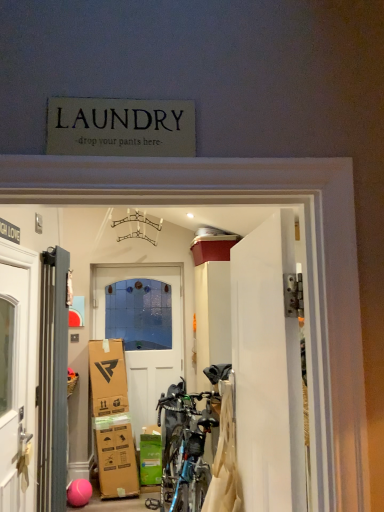
How much space does metallic gray radiator at left, placed as the 2th door when sorted from front to back, occupy horizontally?

It is 3.62 inches.

Where is `green cardboard box at lower center`? The width and height of the screenshot is (384, 512). green cardboard box at lower center is located at coordinates (150, 456).

Does metallic gray radiator at left, positioned as the 2th door in back-to-front order, turn towards green cardboard box at lower center?

No, metallic gray radiator at left, positioned as the 2th door in back-to-front order, is not oriented towards green cardboard box at lower center.

Is point (50, 398) closer to camera compared to point (146, 463)?

That is True.

Do you think metallic gray radiator at left, placed as the 2th door when sorted from front to back, is within green cardboard box at lower center, or outside of it?

The correct answer is: outside.

From a real-world perspective, is metallic gray radiator at left, the third door when ordered from right to left, under white glossy door at center, positioned as the first door in right-to-left order?

Correct, in the physical world, metallic gray radiator at left, the third door when ordered from right to left, is lower than white glossy door at center, positioned as the first door in right-to-left order.

Does metallic gray radiator at left, the 1th door positioned from the left, have a greater height compared to white glossy door at center, placed as the 3th door when sorted from left to right?

Indeed, metallic gray radiator at left, the 1th door positioned from the left, has a greater height compared to white glossy door at center, placed as the 3th door when sorted from left to right.

Which object is positioned more to the right, white wooden door at center, placed as the 2th door when sorted from left to right, or white glossy door at center, which ranks as the first door in front-to-back order?

Positioned to the right is white glossy door at center, which ranks as the first door in front-to-back order.

Is white glossy door at center, the third door from the back, a part of white wooden door at center, acting as the 2th door starting from the right?

Actually, white glossy door at center, the third door from the back, is outside white wooden door at center, acting as the 2th door starting from the right.

I want to click on the 1st door above when counting from the green cardboard box at lower center (from the image's perspective), so click(x=143, y=331).

From the image's perspective, is white wooden door at center, which ranks as the 1th door in back-to-front order, on green cardboard box at lower center?

Yes.

Can you confirm if white wooden door at center, which is the third door from front to back, is shorter than green cardboard box at lower center?

In fact, white wooden door at center, which is the third door from front to back, may be taller than green cardboard box at lower center.

Who is more distant, white wooden door at center, which is the third door from front to back, or green cardboard box at lower center?

white wooden door at center, which is the third door from front to back, is further from the camera.

Can you confirm if green cardboard box at lower center is positioned to the right of white glossy door at center, the third door from the back?

No.

Is green cardboard box at lower center bigger or smaller than white glossy door at center, which ranks as the first door in front-to-back order?

In the image, green cardboard box at lower center appears to be smaller than white glossy door at center, which ranks as the first door in front-to-back order.

Could you measure the distance between green cardboard box at lower center and white glossy door at center, placed as the 3th door when sorted from left to right?

green cardboard box at lower center and white glossy door at center, placed as the 3th door when sorted from left to right, are 9.46 feet apart from each other.

From a real-world perspective, who is located higher, white wooden door at center, acting as the 2th door starting from the right, or metallic gray radiator at left, the 1th door positioned from the left?

metallic gray radiator at left, the 1th door positioned from the left, is physically above.

Is white wooden door at center, which ranks as the 1th door in back-to-front order, smaller than metallic gray radiator at left, the third door when ordered from right to left?

Actually, white wooden door at center, which ranks as the 1th door in back-to-front order, might be larger than metallic gray radiator at left, the third door when ordered from right to left.

Identify the location of door that is the 1st one when counting rightward from the metallic gray radiator at left, the third door when ordered from right to left. Image resolution: width=384 pixels, height=512 pixels. (143, 331).

Are green cardboard box at lower center and white wooden door at center, placed as the 2th door when sorted from left to right, located far from each other?

green cardboard box at lower center is near white wooden door at center, placed as the 2th door when sorted from left to right, not far away.

From a real-world perspective, which is physically below, green cardboard box at lower center or white wooden door at center, which ranks as the 1th door in back-to-front order?

green cardboard box at lower center.

Is green cardboard box at lower center oriented away from white wooden door at center, acting as the 2th door starting from the right?

Yes, white wooden door at center, acting as the 2th door starting from the right, is at the back of green cardboard box at lower center.

Does green cardboard box at lower center have a smaller size compared to white wooden door at center, acting as the 2th door starting from the right?

Yes, green cardboard box at lower center is smaller than white wooden door at center, acting as the 2th door starting from the right.

Locate an element on the screen. This screenshot has width=384, height=512. cardboard box below the metallic gray radiator at left, the third door when ordered from right to left (from the image's perspective) is located at coordinates click(x=150, y=456).

From a real-world perspective, which door is the 1st one underneath the white glossy door at center, placed as the 3th door when sorted from left to right? Please provide its 2D coordinates.

[(53, 382)]

Looking at the image, which one is located further to metallic gray radiator at left, placed as the 2th door when sorted from front to back, white glossy door at center, placed as the 3th door when sorted from left to right, or white wooden door at center, acting as the 2th door starting from the right?

white wooden door at center, acting as the 2th door starting from the right.

Looking at the image, which one is located closer to metallic gray radiator at left, positioned as the 2th door in back-to-front order, green cardboard box at lower center or white glossy door at center, placed as the 3th door when sorted from left to right?

Based on the image, white glossy door at center, placed as the 3th door when sorted from left to right, appears to be nearer to metallic gray radiator at left, positioned as the 2th door in back-to-front order.

When comparing their distances from green cardboard box at lower center, does metallic gray radiator at left, placed as the 2th door when sorted from front to back, or white wooden door at center, acting as the 2th door starting from the right, seem closer?

white wooden door at center, acting as the 2th door starting from the right.

Based on their spatial positions, is metallic gray radiator at left, the 1th door positioned from the left, or white glossy door at center, placed as the 3th door when sorted from left to right, further from green cardboard box at lower center?

Based on the image, white glossy door at center, placed as the 3th door when sorted from left to right, appears to be further to green cardboard box at lower center.

From the image, which object appears to be farther from green cardboard box at lower center, white glossy door at center, positioned as the first door in right-to-left order, or metallic gray radiator at left, the 1th door positioned from the left?

white glossy door at center, positioned as the first door in right-to-left order.

Considering their positions, is green cardboard box at lower center positioned closer to white glossy door at center, positioned as the first door in right-to-left order, than metallic gray radiator at left, placed as the 2th door when sorted from front to back?

The object closer to white glossy door at center, positioned as the first door in right-to-left order, is metallic gray radiator at left, placed as the 2th door when sorted from front to back.

In the scene shown: Estimate the real-world distances between objects in this image. Which object is further from white wooden door at center, which ranks as the 1th door in back-to-front order, metallic gray radiator at left, the 1th door positioned from the left, or green cardboard box at lower center?

metallic gray radiator at left, the 1th door positioned from the left, is further to white wooden door at center, which ranks as the 1th door in back-to-front order.

From the image, which object appears to be nearer to metallic gray radiator at left, placed as the 2th door when sorted from front to back, white wooden door at center, placed as the 2th door when sorted from left to right, or green cardboard box at lower center?

green cardboard box at lower center.

Find the location of a particular element. This screenshot has width=384, height=512. door between white glossy door at center, the third door from the back, and white wooden door at center, acting as the 2th door starting from the right, along the z-axis is located at coordinates (53, 382).

This screenshot has height=512, width=384. I want to click on cardboard box positioned between metallic gray radiator at left, the 1th door positioned from the left, and white wooden door at center, acting as the 2th door starting from the right, from near to far, so click(x=150, y=456).

Identify the location of door between white glossy door at center, the third door from the back, and green cardboard box at lower center in the front-back direction. (53, 382).

You are a GUI agent. You are given a task and a screenshot of the screen. Output one action in this format:
    pyautogui.click(x=<x>, y=<y>)
    Task: Click on the cardboard box between white glossy door at center, positioned as the first door in right-to-left order, and white wooden door at center, placed as the 2th door when sorted from left to right, along the z-axis
    
    Given the screenshot: What is the action you would take?
    pos(150,456)